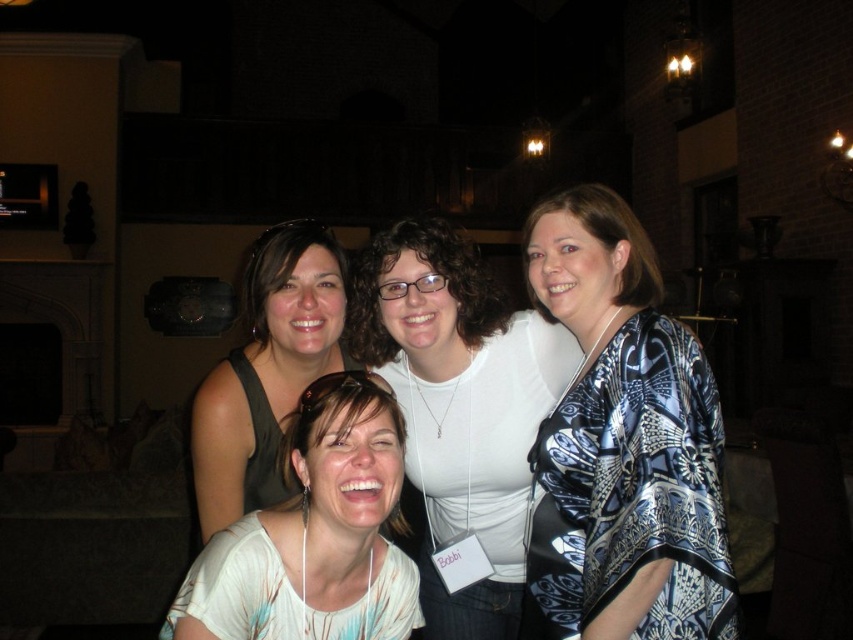
Where is `white fabric shirt at center`? white fabric shirt at center is located at coordinates (314, 534).

Which is more to the left, white fabric shirt at center or matte black shirt at center?

matte black shirt at center is more to the left.

The height and width of the screenshot is (640, 853). In order to click on white fabric shirt at center in this screenshot , I will do point(314,534).

Find the location of a particular element. This screenshot has width=853, height=640. white fabric shirt at center is located at coordinates (314, 534).

Which of these two, white matte shirt at center or matte black shirt at center, stands shorter?

matte black shirt at center

Based on the photo, does white matte shirt at center come behind matte black shirt at center?

That is True.

The image size is (853, 640). Describe the element at coordinates (459, 406) in the screenshot. I see `white matte shirt at center` at that location.

I want to click on white matte shirt at center, so click(x=459, y=406).

Is blue patterned shawl at center to the right of matte black shirt at center from the viewer's perspective?

Indeed, blue patterned shawl at center is positioned on the right side of matte black shirt at center.

Does blue patterned shawl at center have a lesser height compared to matte black shirt at center?

In fact, blue patterned shawl at center may be taller than matte black shirt at center.

Who is more forward, (602, 237) or (277, 316)?

Positioned in front is point (602, 237).

Where is `blue patterned shawl at center`? The width and height of the screenshot is (853, 640). blue patterned shawl at center is located at coordinates (624, 442).